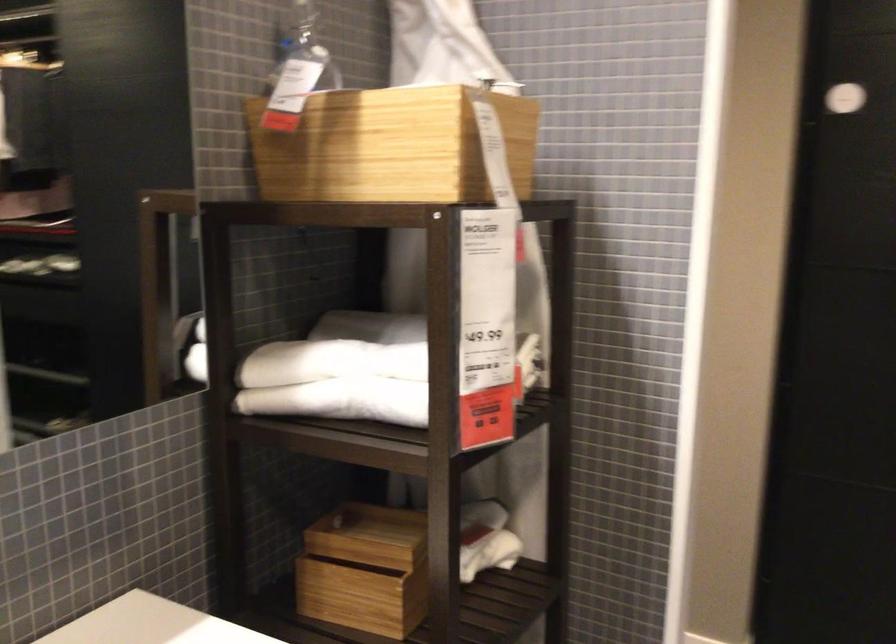
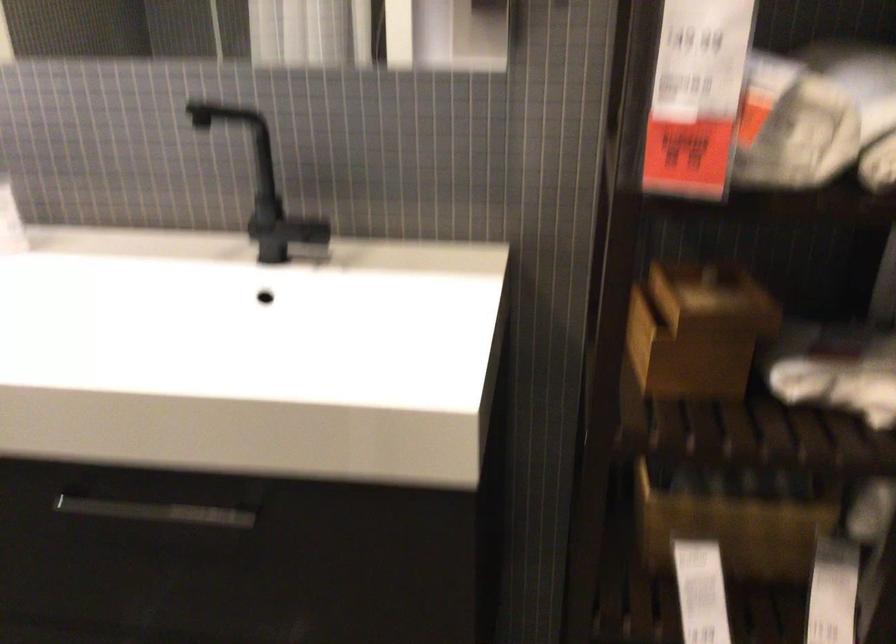
The images are taken continuously from a first-person perspective. In which direction is your viewpoint rotating?

The rotation direction of the camera is left-down.